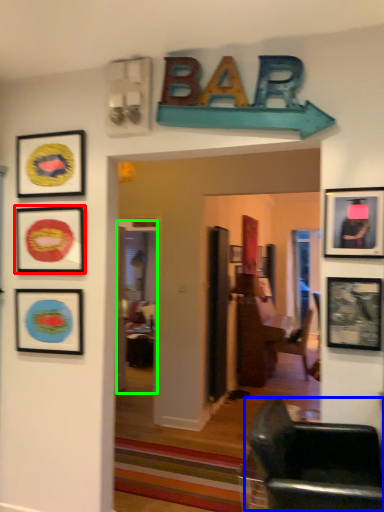
Question: Based on their relative distances, which object is farther from picture frame (highlighted by a red box)? Choose from chair (highlighted by a blue box) and glass door (highlighted by a green box).

Choices:
 (A) chair
 (B) glass door

Answer: (B)